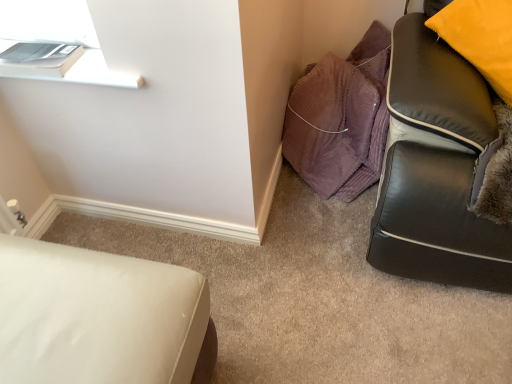
Question: Does purple corduroy pillows at upper right turn towards white leather ottoman at lower left?

Choices:
 (A) no
 (B) yes

Answer: (A)

Question: Is purple corduroy pillows at upper right beside white leather ottoman at lower left?

Choices:
 (A) yes
 (B) no

Answer: (B)

Question: Considering the relative sizes of purple corduroy pillows at upper right and white leather ottoman at lower left in the image provided, is purple corduroy pillows at upper right thinner than white leather ottoman at lower left?

Choices:
 (A) no
 (B) yes

Answer: (B)

Question: Would you say white leather ottoman at lower left is part of purple corduroy pillows at upper right's contents?

Choices:
 (A) no
 (B) yes

Answer: (A)

Question: Is purple corduroy pillows at upper right shorter than white leather ottoman at lower left?

Choices:
 (A) no
 (B) yes

Answer: (B)

Question: Can you confirm if purple corduroy pillows at upper right is positioned to the right of white leather ottoman at lower left?

Choices:
 (A) no
 (B) yes

Answer: (B)

Question: Is white leather ottoman at lower left aimed at purple corduroy pillows at upper right?

Choices:
 (A) no
 (B) yes

Answer: (A)

Question: From a real-world perspective, is white leather ottoman at lower left over purple corduroy pillows at upper right?

Choices:
 (A) no
 (B) yes

Answer: (B)

Question: Are white leather ottoman at lower left and purple corduroy pillows at upper right making contact?

Choices:
 (A) yes
 (B) no

Answer: (B)

Question: Is white leather ottoman at lower left wider than purple corduroy pillows at upper right?

Choices:
 (A) yes
 (B) no

Answer: (A)

Question: Considering the relative sizes of white leather ottoman at lower left and purple corduroy pillows at upper right in the image provided, is white leather ottoman at lower left thinner than purple corduroy pillows at upper right?

Choices:
 (A) yes
 (B) no

Answer: (B)

Question: Does white leather ottoman at lower left have a greater height compared to purple corduroy pillows at upper right?

Choices:
 (A) yes
 (B) no

Answer: (A)

Question: Does point (58, 283) appear closer or farther from the camera than point (360, 145)?

Choices:
 (A) farther
 (B) closer

Answer: (B)